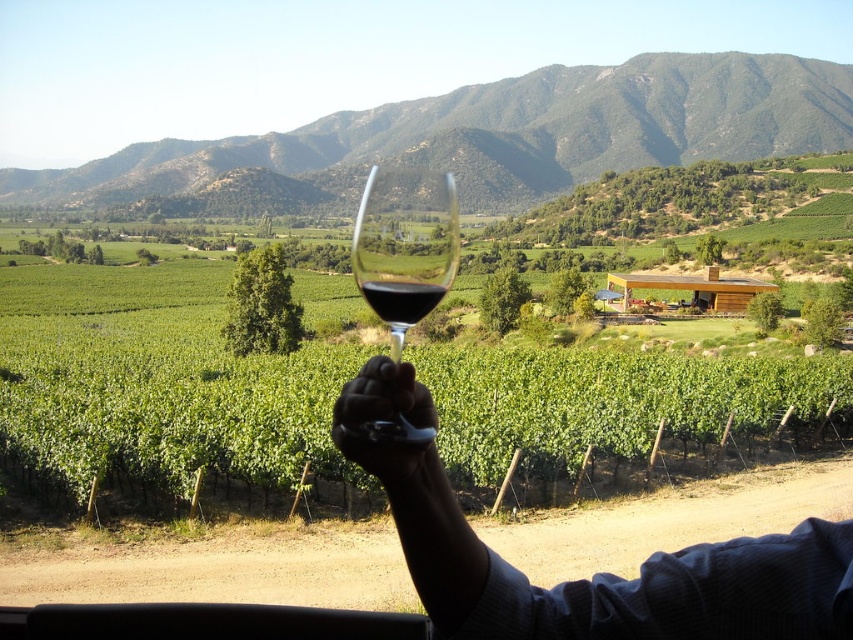
Question: Does silvery metallic knife at center have a greater width compared to transparent glass at center?

Choices:
 (A) no
 (B) yes

Answer: (B)

Question: Estimate the real-world distances between objects in this image. Which object is farther from the green leafy vines at center?

Choices:
 (A) silvery metallic knife at center
 (B) translucent glass at center

Answer: (A)

Question: Does silvery metallic knife at center have a smaller size compared to transparent glass at center?

Choices:
 (A) yes
 (B) no

Answer: (A)

Question: Is the position of transparent glass at center less distant than that of black rubber glove at center?

Choices:
 (A) yes
 (B) no

Answer: (A)

Question: Which point is farther to the camera?

Choices:
 (A) silvery metallic knife at center
 (B) black rubber glove at center
 (C) translucent glass at center
 (D) transparent glass at center

Answer: (A)

Question: Estimate the real-world distances between objects in this image. Which object is farther from the silvery metallic knife at center?

Choices:
 (A) transparent glass at center
 (B) green leafy vines at center
 (C) black rubber glove at center
 (D) translucent glass at center

Answer: (B)